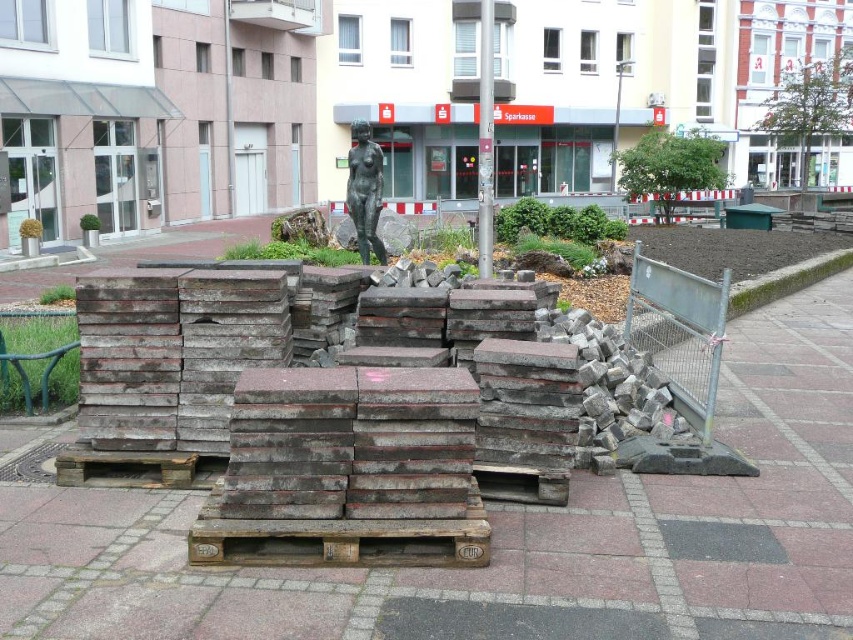
Question: Which of the following is the farthest from the observer?

Choices:
 (A) dark gray concrete paving stones at center
 (B) bronze statue at center

Answer: (B)

Question: Observing the image, what is the correct spatial positioning of dark gray concrete paving stones at center in reference to bronze statue at center?

Choices:
 (A) right
 (B) left

Answer: (A)

Question: Is dark gray concrete paving stones at center thinner than bronze statue at center?

Choices:
 (A) no
 (B) yes

Answer: (A)

Question: Does dark gray concrete paving stones at center appear over bronze statue at center?

Choices:
 (A) yes
 (B) no

Answer: (B)